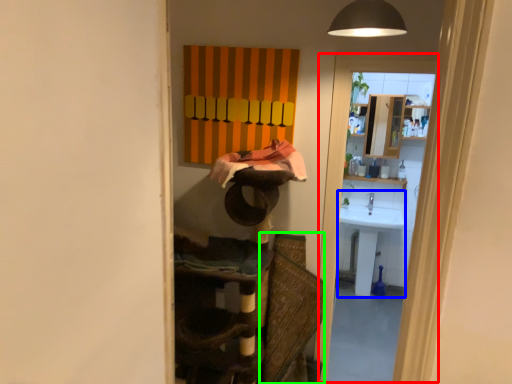
Question: Based on their relative distances, which object is nearer to screen door (highlighted by a red box)? Choose from sink (highlighted by a blue box) and swivel chair (highlighted by a green box).

Choices:
 (A) sink
 (B) swivel chair

Answer: (B)